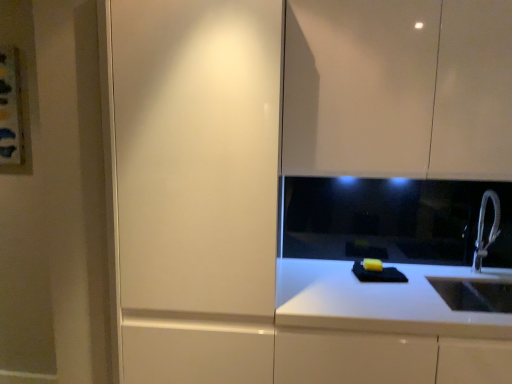
The width and height of the screenshot is (512, 384). I want to click on matte white cabinet at left, so [x=196, y=186].

What is the approximate height of white metallic faucet at right?

The height of white metallic faucet at right is 16.83 inches.

Find the location of a particular element. The height and width of the screenshot is (384, 512). glossy white cabinet at upper right is located at coordinates (398, 88).

Find the location of `matte white cabinet at left`. matte white cabinet at left is located at coordinates (196, 186).

Between white glossy countertop at lower right and matte white cabinet at left, which one has more height?

matte white cabinet at left is taller.

From the image's perspective, is white glossy countertop at lower right located above matte white cabinet at left?

No, from the image's perspective, white glossy countertop at lower right is not above matte white cabinet at left.

Does point (371, 309) lie in front of point (213, 167)?

That is False.

Measure the distance from white glossy countertop at lower right to matte white cabinet at left.

A distance of 23.39 inches exists between white glossy countertop at lower right and matte white cabinet at left.

Is glossy white cabinet at upper right positioned with its back to white metallic faucet at right?

No, glossy white cabinet at upper right's orientation is not away from white metallic faucet at right.

Where is `cabinetry above the white metallic faucet at right (from the image's perspective)`? The height and width of the screenshot is (384, 512). cabinetry above the white metallic faucet at right (from the image's perspective) is located at coordinates (398, 88).

Is the depth of glossy white cabinet at upper right less than that of white metallic faucet at right?

Yes, it is in front of white metallic faucet at right.

Locate an element on the screen. The image size is (512, 384). cabinetry above the white glossy countertop at lower right (from a real-world perspective) is located at coordinates (398, 88).

Which object is positioned more to the right, glossy white cabinet at upper right or white glossy countertop at lower right?

Positioned to the right is white glossy countertop at lower right.

Consider the image. From a real-world perspective, is glossy white cabinet at upper right below white glossy countertop at lower right?

Incorrect, from a real-world perspective, glossy white cabinet at upper right is higher than white glossy countertop at lower right.

From the image's perspective, between glossy white cabinet at upper right and white glossy countertop at lower right, which one is located above?

From the image's view, glossy white cabinet at upper right is above.

Is matte white cabinet at left to the left or to the right of white glossy countertop at lower right in the image?

From the image, it's evident that matte white cabinet at left is to the left of white glossy countertop at lower right.

Considering the positions of objects matte white cabinet at left and white glossy countertop at lower right in the image provided, who is behind, matte white cabinet at left or white glossy countertop at lower right?

Positioned behind is white glossy countertop at lower right.

From the image's perspective, is matte white cabinet at left located above white glossy countertop at lower right?

Yes, from the image's perspective, matte white cabinet at left is on top of white glossy countertop at lower right.

Consider the image. Is matte white cabinet at left facing towards white glossy countertop at lower right?

No, matte white cabinet at left is not oriented towards white glossy countertop at lower right.

Considering the sizes of white metallic faucet at right and glossy white cabinet at upper right in the image, is white metallic faucet at right wider or thinner than glossy white cabinet at upper right?

Considering their sizes, white metallic faucet at right looks slimmer than glossy white cabinet at upper right.

Consider the image. Do you think white metallic faucet at right is within glossy white cabinet at upper right, or outside of it?

white metallic faucet at right cannot be found inside glossy white cabinet at upper right.

In the scene shown: Considering the positions of objects white metallic faucet at right and glossy white cabinet at upper right in the image provided, who is behind, white metallic faucet at right or glossy white cabinet at upper right?

white metallic faucet at right.

Is white metallic faucet at right to the left of glossy white cabinet at upper right from the viewer's perspective?

No.

Could you tell me if matte white cabinet at left is facing glossy white cabinet at upper right?

No, matte white cabinet at left is not turned towards glossy white cabinet at upper right.

Considering the positions of point (234, 368) and point (426, 15), is point (234, 368) closer or farther from the camera than point (426, 15)?

Point (234, 368) is farther from the camera than point (426, 15).

From the image's perspective, is matte white cabinet at left located above glossy white cabinet at upper right?

Actually, matte white cabinet at left appears below glossy white cabinet at upper right in the image.

In terms of height, does matte white cabinet at left look taller or shorter compared to glossy white cabinet at upper right?

In the image, matte white cabinet at left appears to be taller than glossy white cabinet at upper right.

Does matte white cabinet at left have a lesser height compared to white metallic faucet at right?

No.

How different are the orientations of matte white cabinet at left and white metallic faucet at right in degrees?

matte white cabinet at left and white metallic faucet at right are facing 0.00215 degrees away from each other.

Does matte white cabinet at left have a greater width compared to white metallic faucet at right?

Correct, the width of matte white cabinet at left exceeds that of white metallic faucet at right.

Which of these two, matte white cabinet at left or white metallic faucet at right, is smaller?

white metallic faucet at right.

Where is `countertop directly beneath the matte white cabinet at left (from a real-world perspective)`? The width and height of the screenshot is (512, 384). countertop directly beneath the matte white cabinet at left (from a real-world perspective) is located at coordinates (381, 301).

In the image, there is a white metallic faucet at right. Where is `cabinetry above it (from the image's perspective)`? Image resolution: width=512 pixels, height=384 pixels. cabinetry above it (from the image's perspective) is located at coordinates (398, 88).

When comparing their distances from matte white cabinet at left, does white glossy countertop at lower right or glossy white cabinet at upper right seem further?

white glossy countertop at lower right is further to matte white cabinet at left.

Based on the photo, considering their positions, is glossy white cabinet at upper right positioned closer to white metallic faucet at right than white glossy countertop at lower right?

white glossy countertop at lower right.

Estimate the real-world distances between objects in this image. Which object is further from glossy white cabinet at upper right, white glossy countertop at lower right or white metallic faucet at right?

white metallic faucet at right.

Based on the photo, from the image, which object appears to be nearer to white glossy countertop at lower right, white metallic faucet at right or matte white cabinet at left?

Based on the image, white metallic faucet at right appears to be nearer to white glossy countertop at lower right.

From the image, which object appears to be nearer to white metallic faucet at right, glossy white cabinet at upper right or matte white cabinet at left?

Among the two, glossy white cabinet at upper right is located nearer to white metallic faucet at right.

Looking at the image, which one is located closer to white metallic faucet at right, matte white cabinet at left or white glossy countertop at lower right?

white glossy countertop at lower right is closer to white metallic faucet at right.

Estimate the real-world distances between objects in this image. Which object is closer to white glossy countertop at lower right, matte white cabinet at left or glossy white cabinet at upper right?

matte white cabinet at left is closer to white glossy countertop at lower right.

Based on the photo, estimate the real-world distances between objects in this image. Which object is closer to white glossy countertop at lower right, white metallic faucet at right or glossy white cabinet at upper right?

white metallic faucet at right lies closer to white glossy countertop at lower right than the other object.

At what (x,y) coordinates should I click in order to perform the action: click on cabinetry between matte white cabinet at left and white metallic faucet at right from left to right. Please return your answer as a coordinate pair (x, y). The width and height of the screenshot is (512, 384). Looking at the image, I should click on (398, 88).

What are the coordinates of `countertop between matte white cabinet at left and white metallic faucet at right` in the screenshot? It's located at (381, 301).

This screenshot has height=384, width=512. In order to click on tap that lies between glossy white cabinet at upper right and white glossy countertop at lower right from top to bottom in this screenshot , I will do `click(483, 228)`.

Find the location of a particular element. screen door between glossy white cabinet at upper right and white glossy countertop at lower right in the vertical direction is located at coordinates (196, 186).